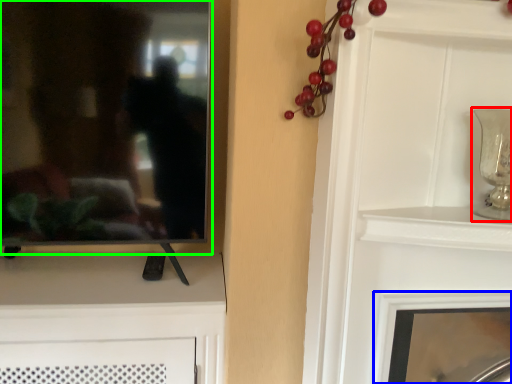
Question: Which is farther away from candle holder (highlighted by a red box)? fireplace (highlighted by a blue box) or mirror (highlighted by a green box)?

Choices:
 (A) fireplace
 (B) mirror

Answer: (B)